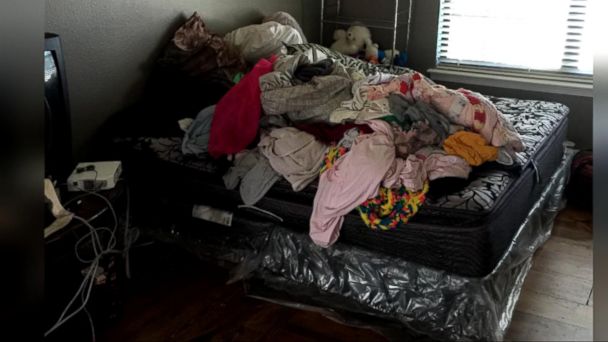
You are a GUI agent. You are given a task and a screenshot of the screen. Output one action in this format:
    pyautogui.click(x=<x>, y=<y>)
    Task: Click on the window blinds
    The image size is (608, 342).
    Given the screenshot: What is the action you would take?
    pyautogui.click(x=505, y=45)